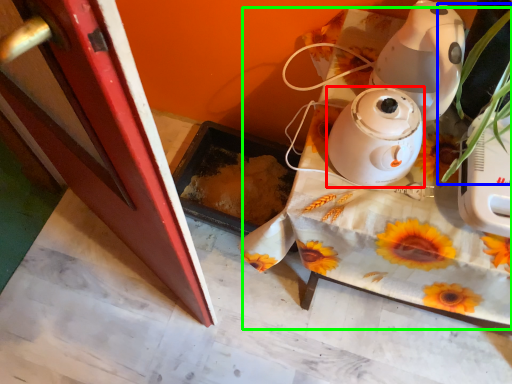
Question: Which is nearer to the home appliance (highlighted by a red box)? plant (highlighted by a blue box) or table (highlighted by a green box).

Choices:
 (A) plant
 (B) table

Answer: (A)